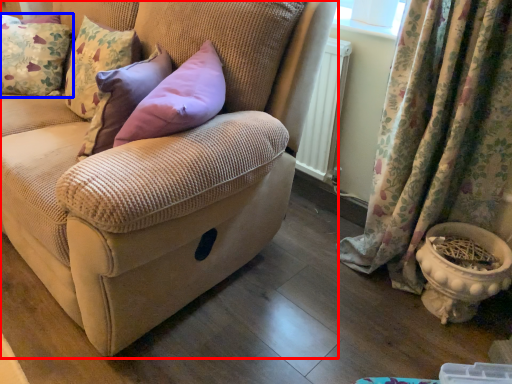
Question: Which point is closer to the camera, studio couch (highlighted by a red box) or pillow (highlighted by a blue box)?

Choices:
 (A) studio couch
 (B) pillow

Answer: (A)